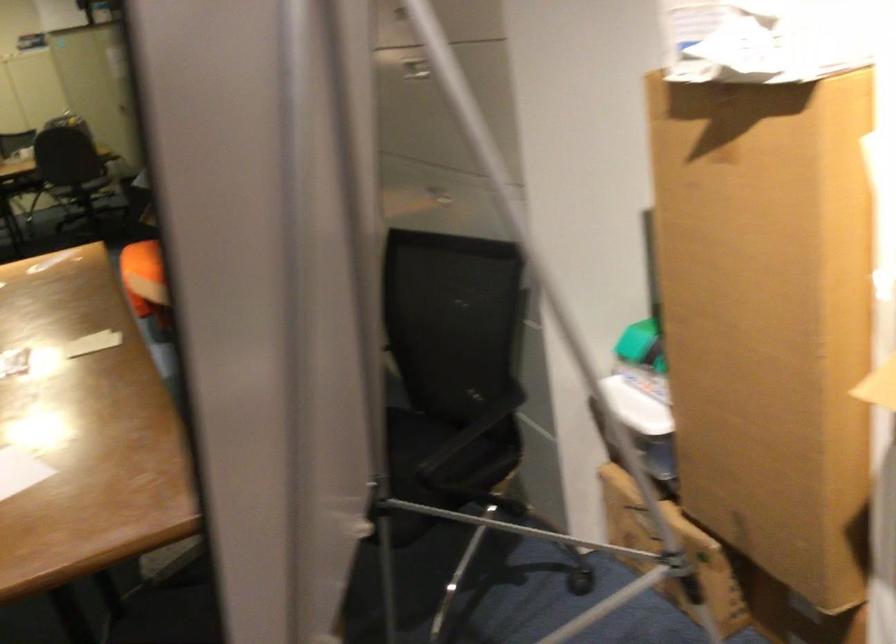
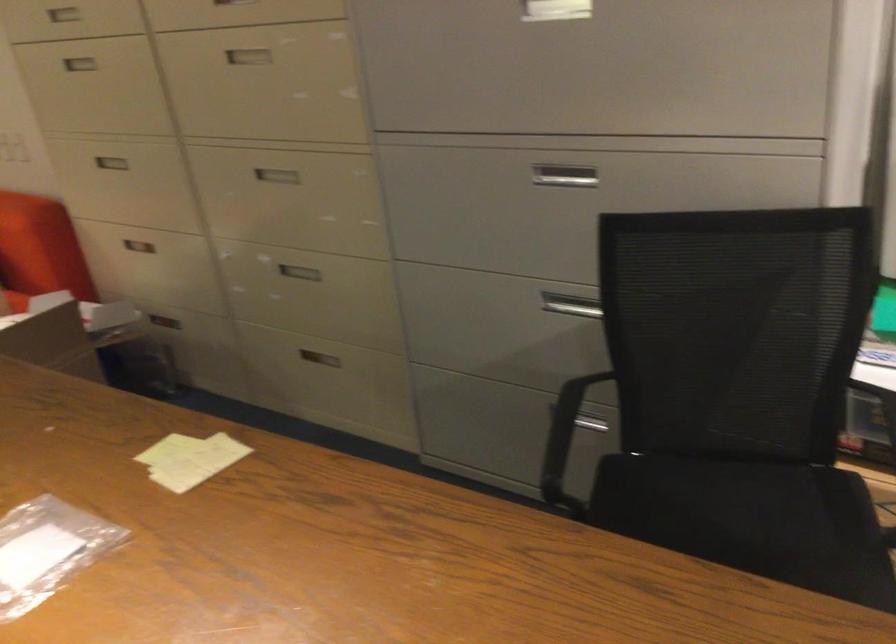
The point at (428, 451) is marked in the first image. Where is the corresponding point in the second image?

(739, 496)